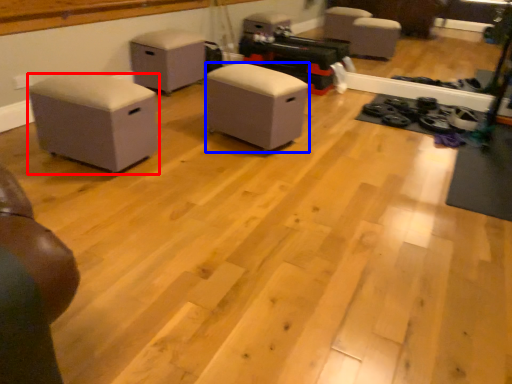
Question: Which of the following is the closest to the observer, furniture (highlighted by a red box) or furniture (highlighted by a blue box)?

Choices:
 (A) furniture
 (B) furniture

Answer: (A)